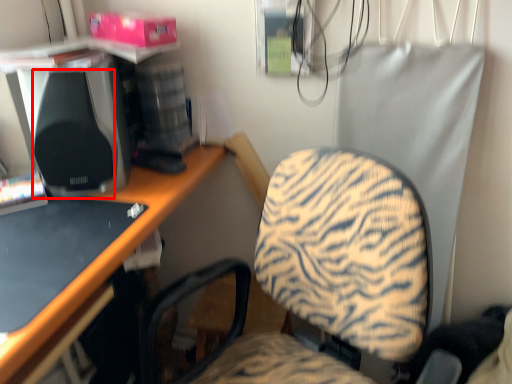
Question: From the image's perspective, where is speaker (annotated by the red box) located relative to desktop?

Choices:
 (A) above
 (B) below

Answer: (A)